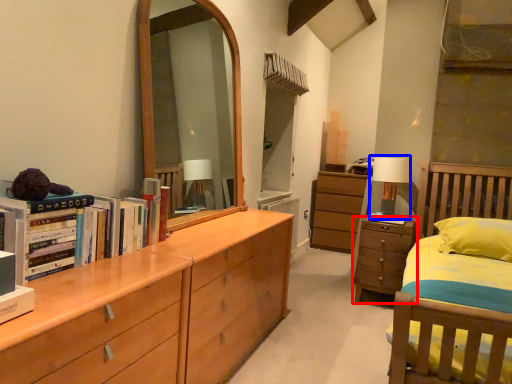
Question: Among these objects, which one is farthest to the camera, chest of drawers (highlighted by a red box) or table lamp (highlighted by a blue box)?

Choices:
 (A) chest of drawers
 (B) table lamp

Answer: (B)